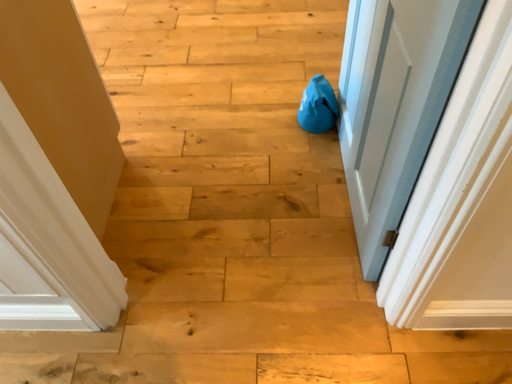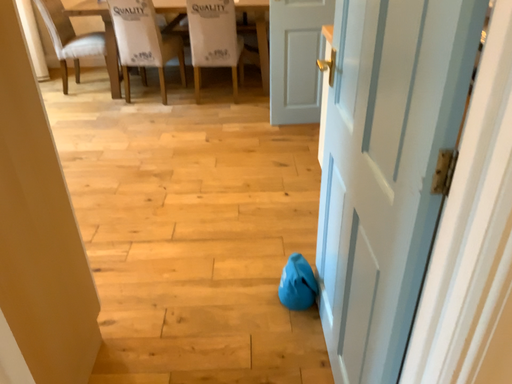
Question: How did the camera likely rotate when shooting the video?

Choices:
 (A) rotated downward
 (B) rotated upward

Answer: (B)